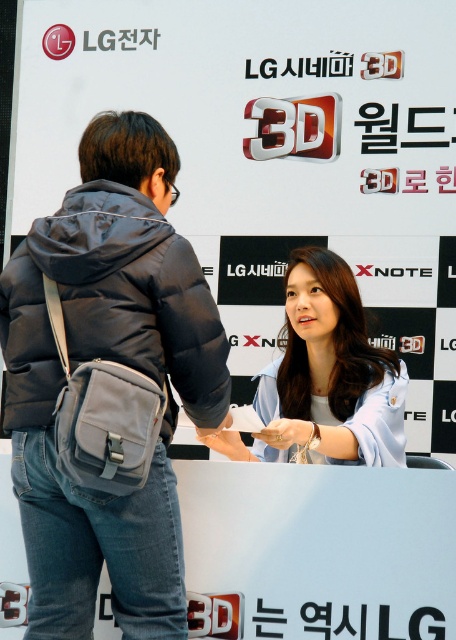
Between dark gray puffer jacket at center and light blue fabric shirt at center, which one appears on the left side from the viewer's perspective?

From the viewer's perspective, dark gray puffer jacket at center appears more on the left side.

Who is higher up, dark gray puffer jacket at center or light blue fabric shirt at center?

dark gray puffer jacket at center is above.

Is point (129, 276) positioned behind point (284, 410)?

No, it is not.

The width and height of the screenshot is (456, 640). Find the location of `dark gray puffer jacket at center`. dark gray puffer jacket at center is located at coordinates (110, 305).

I want to click on white matte hand at center, so click(x=224, y=440).

Consider the image. Is white matte hand at center bigger than satin white wristband at lower center?

Correct, white matte hand at center is larger in size than satin white wristband at lower center.

Which is behind, point (196, 429) or point (271, 424)?

Point (196, 429)

Locate an element on the screen. white matte hand at center is located at coordinates (224, 440).

Does denim jacket at center have a smaller size compared to white matte hand at center?

Incorrect, denim jacket at center is not smaller in size than white matte hand at center.

Is denim jacket at center bigger than white matte hand at center?

Yes.

Is point (346, 380) positioned before point (206, 436)?

No, (346, 380) is behind (206, 436).

Identify the location of denim jacket at center. (102, 365).